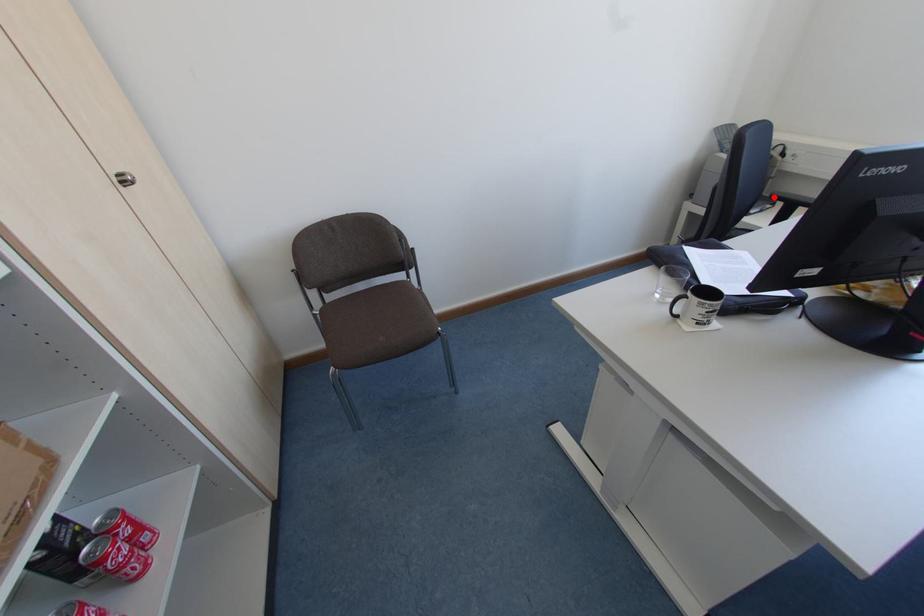
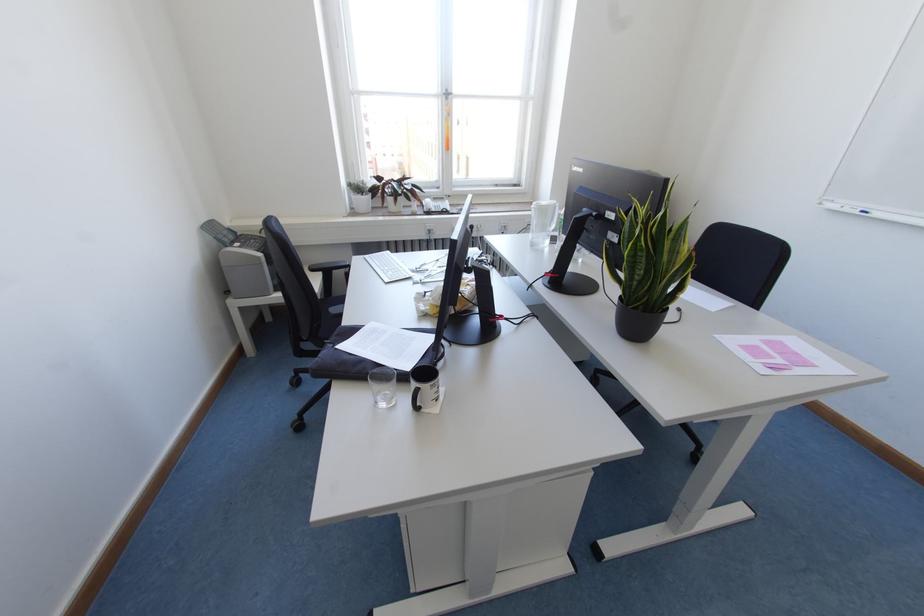
Where in the second image is the point corresponding to the highlighted location from the first image?

(312, 270)